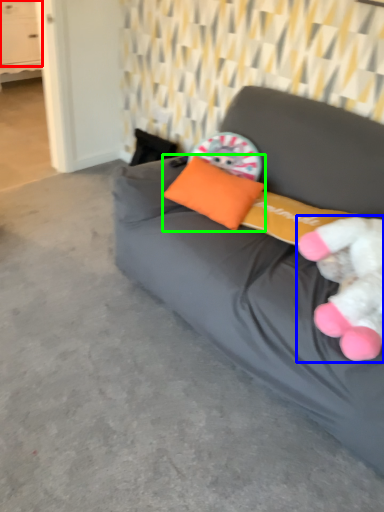
Question: Estimate the real-world distances between objects in this image. Which object is farther from drawer (highlighted by a red box), toy (highlighted by a blue box) or pillow (highlighted by a green box)?

Choices:
 (A) toy
 (B) pillow

Answer: (A)